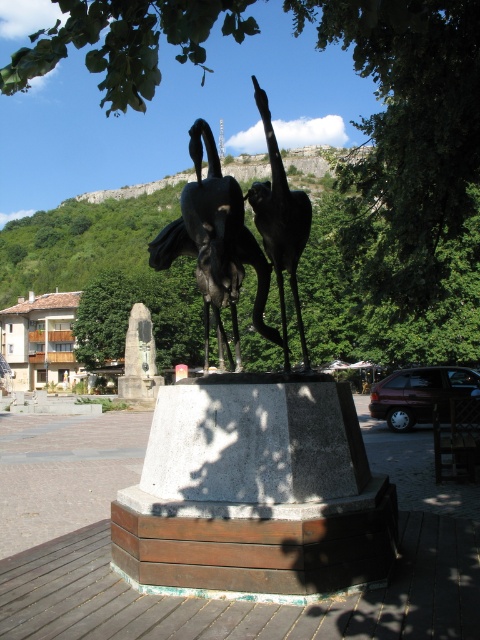
Can you confirm if polished bronze birds at center is thinner than shiny bronze bird at center?

Incorrect, polished bronze birds at center's width is not less than shiny bronze bird at center's.

Find the location of a particular element. This screenshot has height=640, width=480. polished bronze birds at center is located at coordinates (215, 243).

Does green leafy tree at upper center have a lesser width compared to shiny bronze bird at center?

No.

Does green leafy tree at upper center appear on the right side of shiny bronze bird at center?

Incorrect, green leafy tree at upper center is not on the right side of shiny bronze bird at center.

Identify the location of green leafy tree at upper center. This screenshot has width=480, height=640. (410, 120).

Where is `green leafy tree at upper center`? The image size is (480, 640). green leafy tree at upper center is located at coordinates (410, 120).

Does bronze sculpture at center appear over shiny bronze bird at center?

Incorrect, bronze sculpture at center is not positioned above shiny bronze bird at center.

Is bronze sculpture at center smaller than shiny bronze bird at center?

Yes.

Who is more distant from viewer, (x=189, y=572) or (x=283, y=259)?

The point (x=283, y=259) is more distant.

Locate an element on the screen. This screenshot has height=640, width=480. bronze sculpture at center is located at coordinates (x=255, y=492).